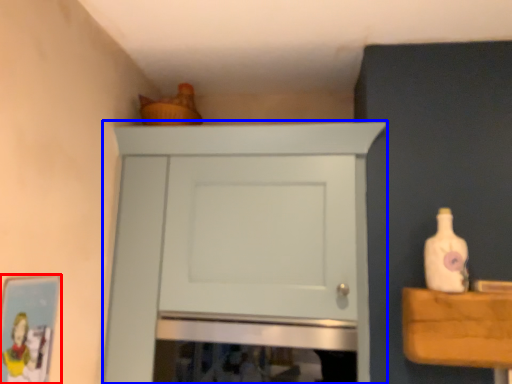
Question: Which object appears closest to the camera in this image, picture frame (highlighted by a red box) or cupboard (highlighted by a blue box)?

Choices:
 (A) picture frame
 (B) cupboard

Answer: (A)